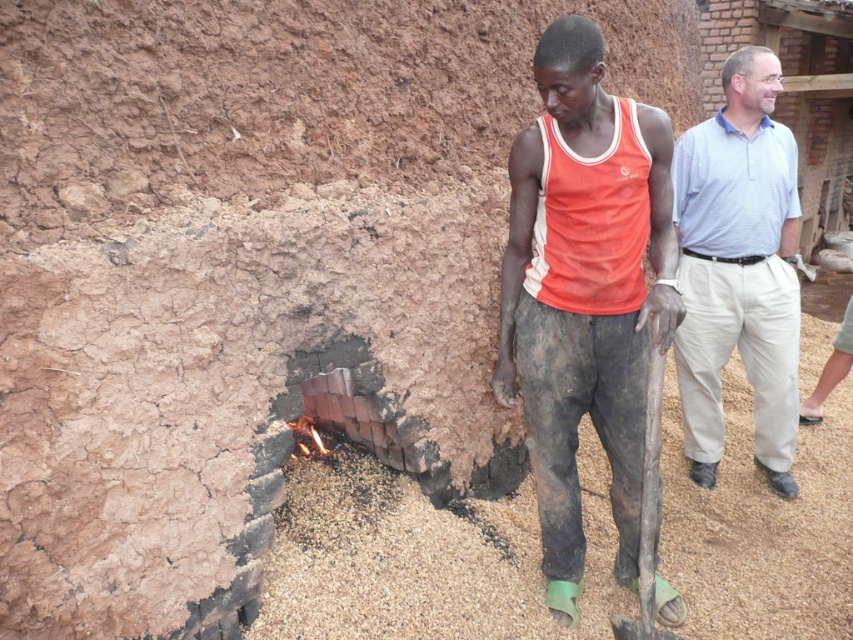
Does light blue striped shirt at right have a smaller size compared to light blue cotton shirt at upper right?

No, light blue striped shirt at right is not smaller than light blue cotton shirt at upper right.

Can you confirm if light blue striped shirt at right is shorter than light blue cotton shirt at upper right?

Incorrect, light blue striped shirt at right's height does not fall short of light blue cotton shirt at upper right's.

Is point (776, 428) more distant than point (682, 196)?

Yes.

This screenshot has height=640, width=853. Find the location of `light blue striped shirt at right`. light blue striped shirt at right is located at coordinates (738, 269).

Can you confirm if matte orange tank top at center is thinner than light blue striped shirt at right?

Incorrect, matte orange tank top at center's width is not less than light blue striped shirt at right's.

Who is taller, matte orange tank top at center or light blue striped shirt at right?

light blue striped shirt at right

Find the location of a particular element. This screenshot has height=640, width=853. matte orange tank top at center is located at coordinates (584, 291).

Which is below, matte orange tank top at center or light blue cotton shirt at upper right?

Positioned lower is matte orange tank top at center.

Is matte orange tank top at center to the right of light blue cotton shirt at upper right from the viewer's perspective?

Incorrect, matte orange tank top at center is not on the right side of light blue cotton shirt at upper right.

Is point (595, 428) closer to camera compared to point (762, 232)?

Yes, it is in front of point (762, 232).

Locate an element on the screen. The height and width of the screenshot is (640, 853). matte orange tank top at center is located at coordinates (584, 291).